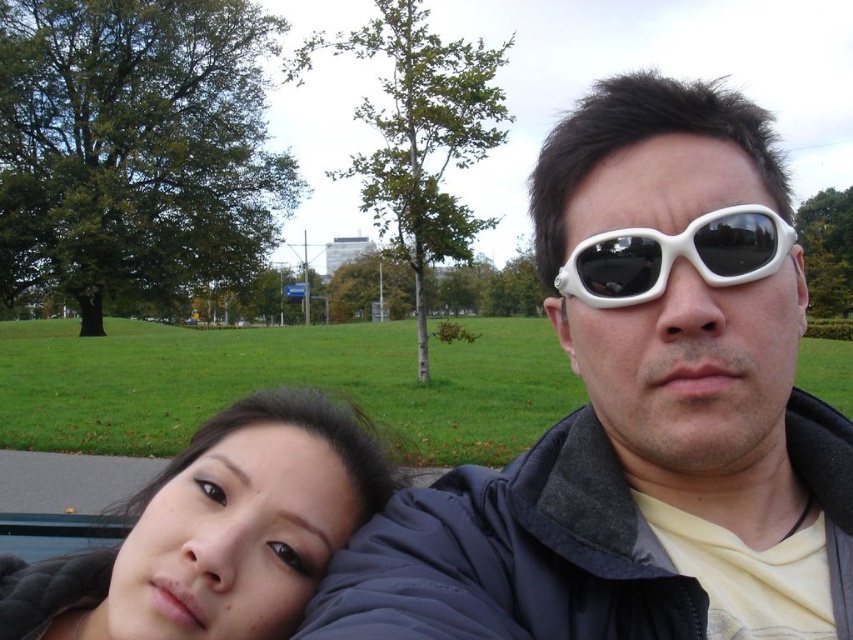
Question: Is white plastic sunglasses at upper right to the left of smooth black hair at lower left from the viewer's perspective?

Choices:
 (A) no
 (B) yes

Answer: (A)

Question: Does smooth black hair at lower left appear on the right side of white matte goggles at upper right?

Choices:
 (A) yes
 (B) no

Answer: (B)

Question: Is white plastic sunglasses at upper right wider than smooth black hair at lower left?

Choices:
 (A) no
 (B) yes

Answer: (B)

Question: Which object is the farthest from the white plastic sunglasses at upper right?

Choices:
 (A) white matte goggles at upper right
 (B) smooth black hair at lower left

Answer: (B)

Question: Based on their relative distances, which object is farther from the white plastic sunglasses at upper right?

Choices:
 (A) white matte goggles at upper right
 (B) smooth black hair at lower left

Answer: (B)

Question: Which object is farther from the camera taking this photo?

Choices:
 (A) white plastic sunglasses at upper right
 (B) white matte goggles at upper right

Answer: (B)